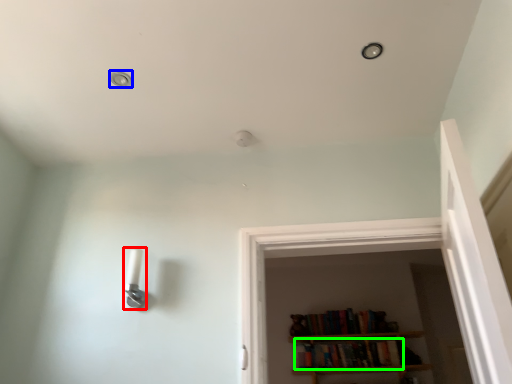
Question: Which object is the farthest from light fixture (highlighted by a red box)? Choose among these: dot (highlighted by a blue box) or book (highlighted by a green box).

Choices:
 (A) dot
 (B) book

Answer: (B)